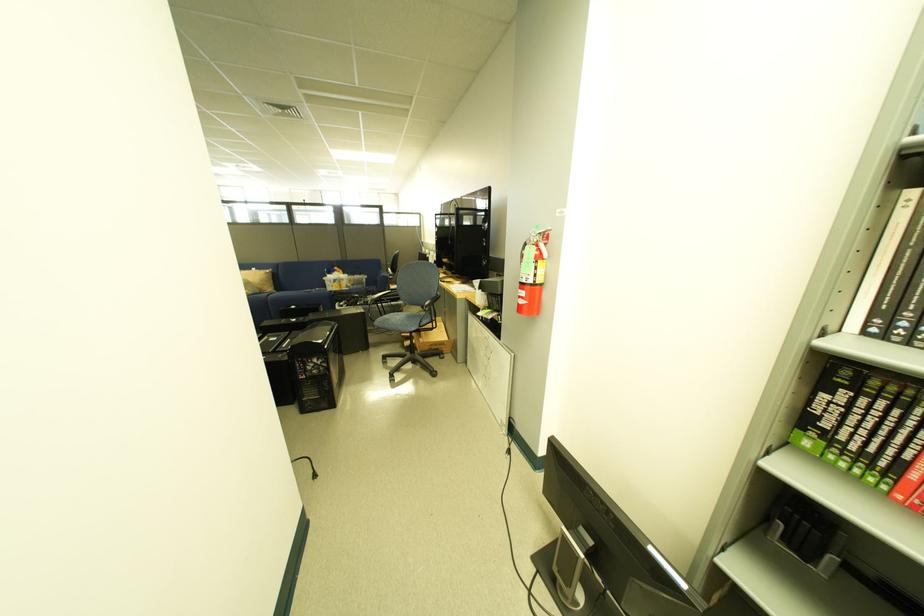
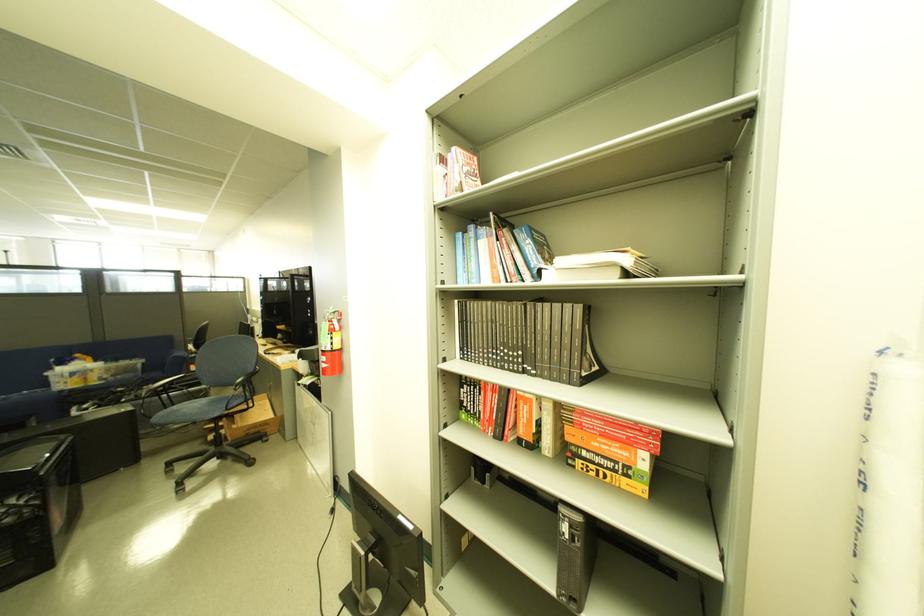
The point at (331, 365) is marked in the first image. Where is the corresponding point in the second image?

(33, 504)